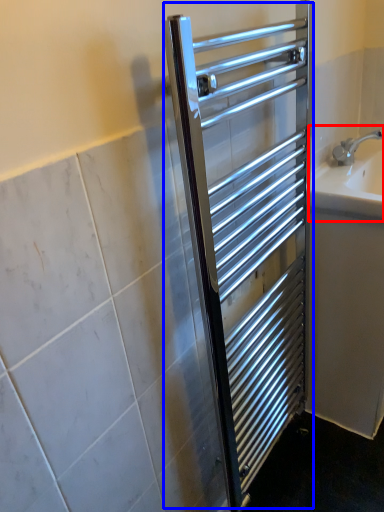
Question: Which object appears closest to the camera in this image, sink (highlighted by a red box) or screen door (highlighted by a blue box)?

Choices:
 (A) sink
 (B) screen door

Answer: (B)